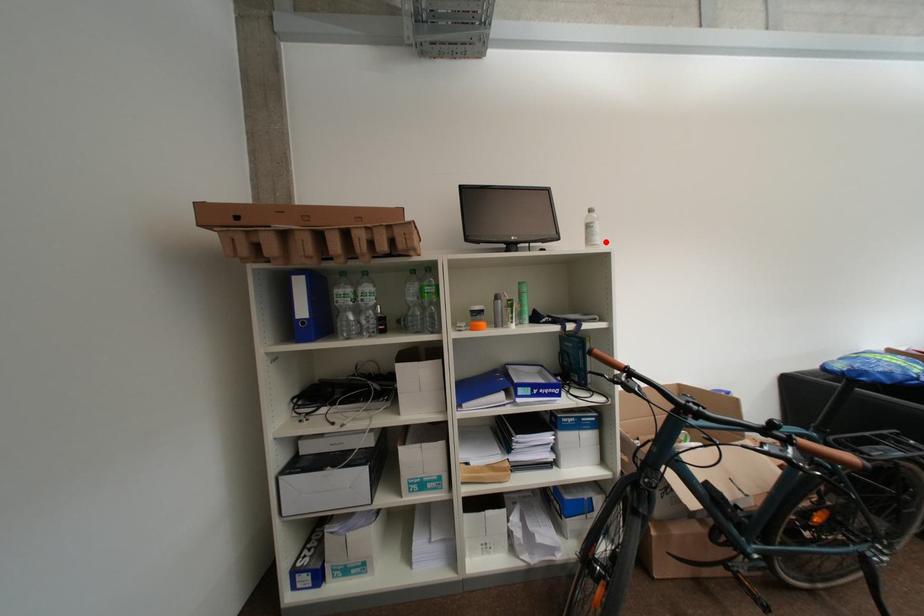
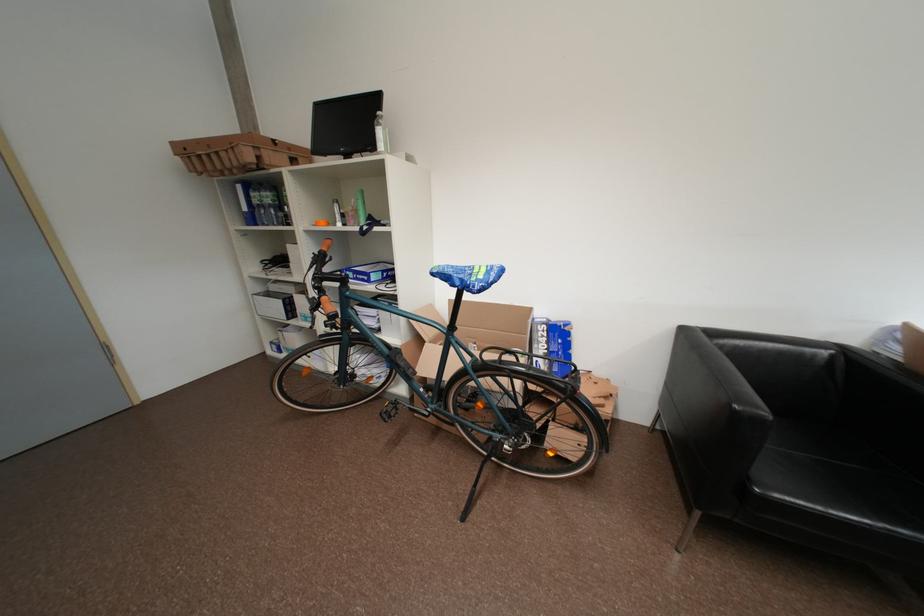
Find the pixel in the second image that matches the highlighted location in the first image.

(388, 148)